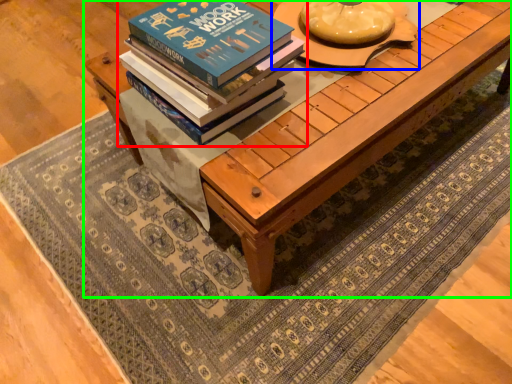
Question: Which object is the closest to the book (highlighted by a red box)? Choose among these: round table (highlighted by a blue box) or table (highlighted by a green box).

Choices:
 (A) round table
 (B) table

Answer: (B)